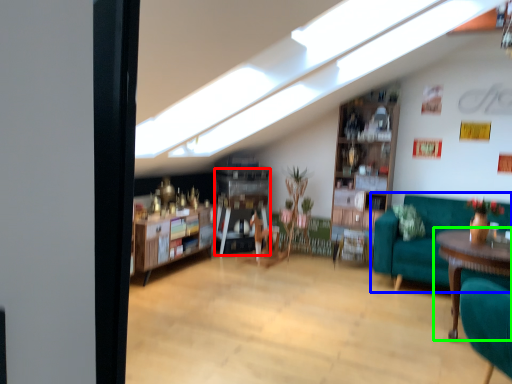
Question: Which object is the closest to the shelf (highlighted by a red box)? Choose among these: studio couch (highlighted by a blue box) or table (highlighted by a green box).

Choices:
 (A) studio couch
 (B) table

Answer: (A)